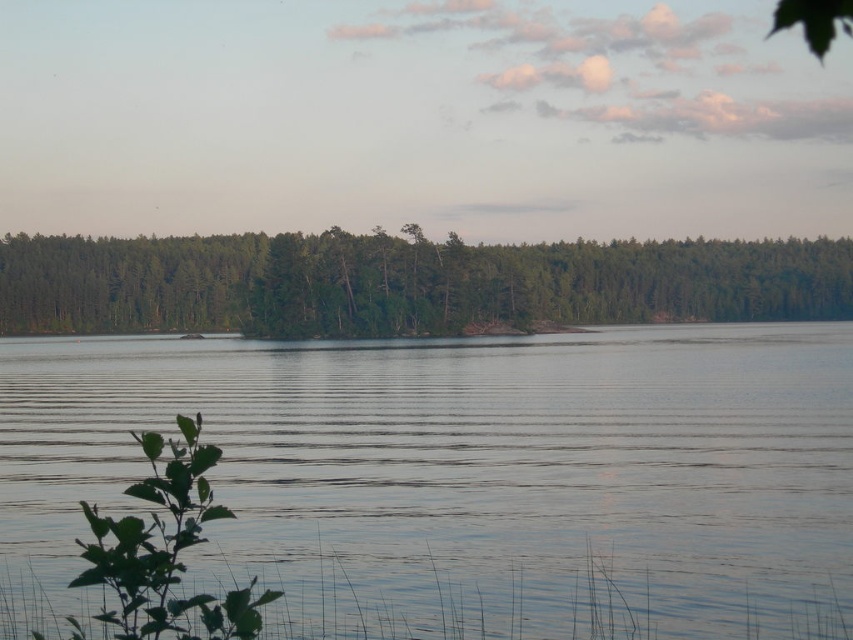
You are a photographer trying to capture the reflection of the clear water at center in your shot. Based on the scene, where should you position your camera to ensure the reflection is centered in the frame?

To center the reflection of the clear water at center in the frame, position your camera directly above the point at coordinates (467, 474) where the clear water at center is located.

You are standing at the lakeside and want to locate two points marked in the image. The first point is at coordinate point(x=664, y=358) and the second is at point(x=821, y=317). Which point is closer to you?

Point(x=664, y=358) is in front of point(x=821, y=317), so it is closer to you.

You are an environmental scientist assessing the lake and forest in the image. Based on the scene, which object occupies a larger vertical space in the image? Please refer to the clear water at center and the green matte forest at center in your analysis.

The green matte forest at center occupies a larger vertical space in the image because it is taller than the clear water at center according to the description.